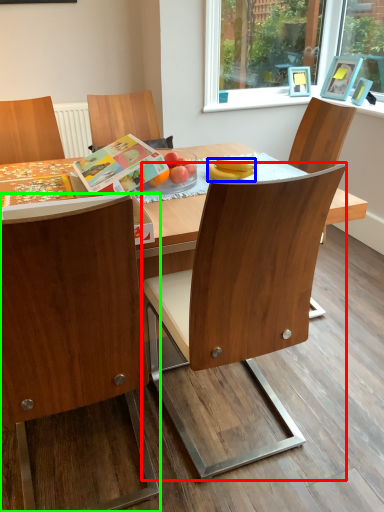
Question: Considering the real-world distances, which object is closest to chair (highlighted by a red box)? banana (highlighted by a blue box) or chair (highlighted by a green box).

Choices:
 (A) banana
 (B) chair

Answer: (B)